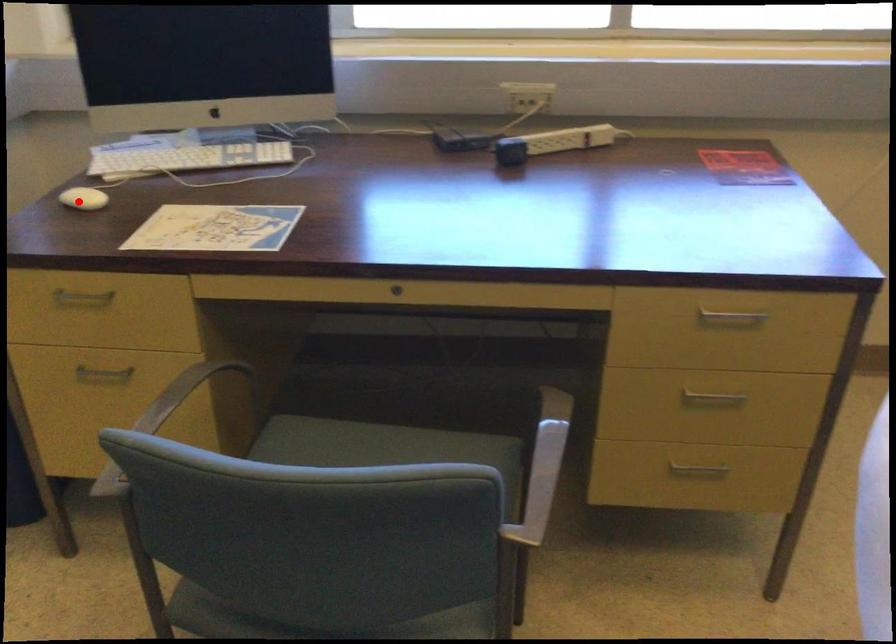
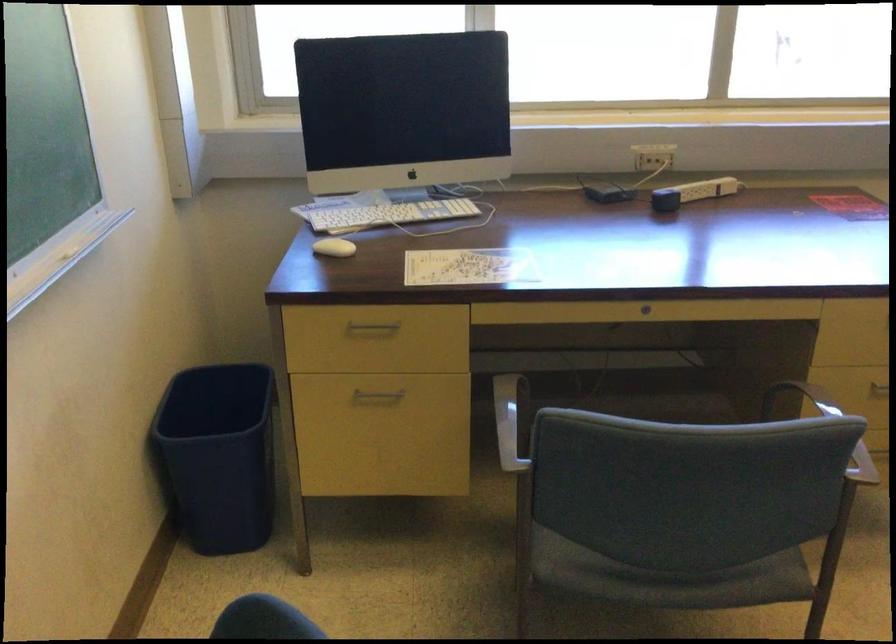
Question: I am providing you with two images of the same scene from different viewpoints. In image1, a red point is highlighted. Considering the same 3D point in image2, which of the following is correct?

Choices:
 (A) It is closer
 (B) It is farther

Answer: (B)